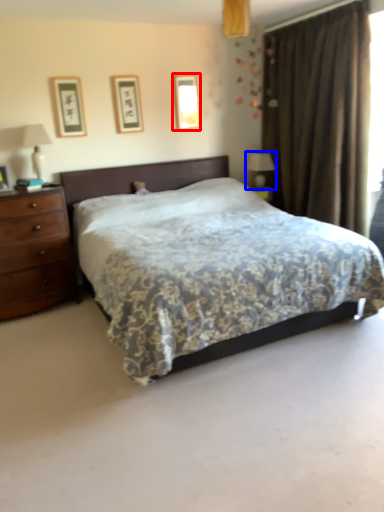
Question: Which object appears farthest to the camera in this image, picture frame (highlighted by a red box) or table lamp (highlighted by a blue box)?

Choices:
 (A) picture frame
 (B) table lamp

Answer: (B)